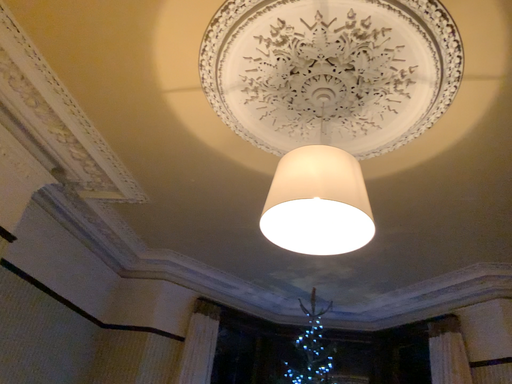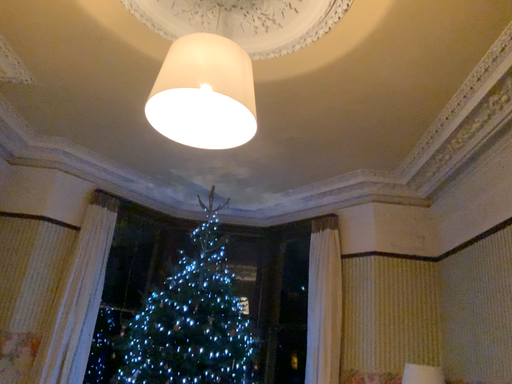
Question: Which way did the camera rotate in the video?

Choices:
 (A) rotated upward
 (B) rotated downward

Answer: (B)